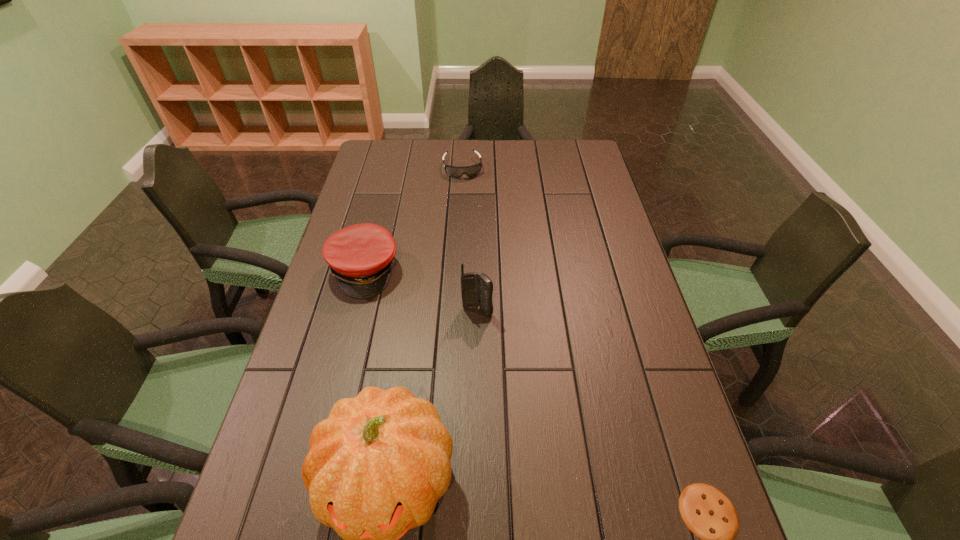
The width and height of the screenshot is (960, 540). I want to click on free space on the desktop that is between the pumpkin and the rightmost object and is positioned on the front and sides of the second shortest object, so click(519, 495).

Find the location of `free space on the desktop that is between the tallest object and the rightmost object and is positioned on the front of the second farthest object with an emblem`. free space on the desktop that is between the tallest object and the rightmost object and is positioned on the front of the second farthest object with an emblem is located at coordinates (501, 493).

At what (x,y) coordinates should I click in order to perform the action: click on vacant space on the desktop that is between the tallest object and the cookie and is positioned on the keyboard of the second tallest object. Please return your answer as a coordinate pair (x, y). The height and width of the screenshot is (540, 960). Looking at the image, I should click on (505, 494).